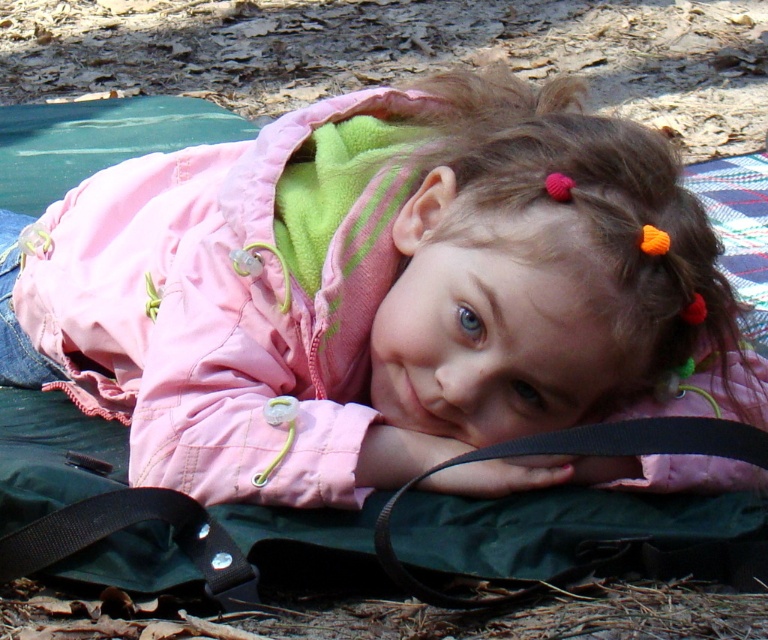
You are a photographer trying to capture a closeup of the black fabric strap at lower left without the pink fabric jacket at center blocking it. What should you do?

The pink fabric jacket at center is closer to you than the black fabric strap at lower left, so you should move your camera position to avoid the jacket blocking the strap.

You are a photographer trying to capture the pink fabric jacket at center in a photo. The camera is set to focus at point coordinates of 0.5, 0.5. Will the jacket be in focus?

The pink fabric jacket at center is at point coordinates of (372, 289), which is very close to the camera focus point of (384, 320). Therefore, the jacket will be in focus.

You are a photographer setting up a shot of the child lying on the mat. You need to ensure that the pink fabric jacket at center and the black fabric strap at lower left are both in focus. Given that your camera can only focus on objects within a 10 inch range, will both objects be in focus?

The pink fabric jacket at center is 10.62 inches from the black fabric strap at lower left. Since the distance between them exceeds the camera focus range of 10 inches, the camera cannot keep both in focus simultaneously.